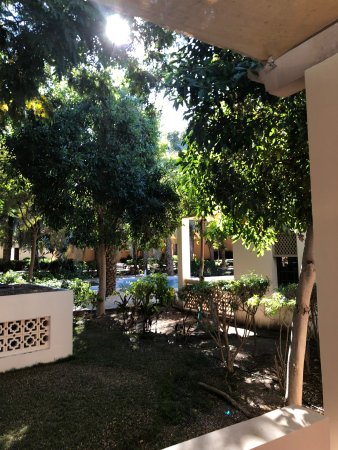
Locate an element on the screen. back wall is located at coordinates (259, 264).